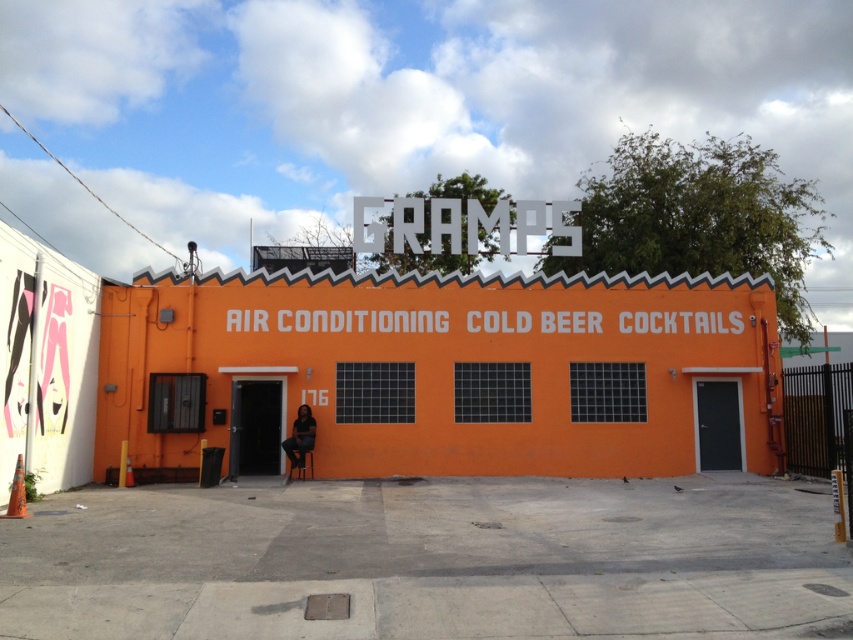
Question: Does white plastic sign at upper center appear under matte black chair at center?

Choices:
 (A) yes
 (B) no

Answer: (B)

Question: Among these points, which one is nearest to the camera?

Choices:
 (A) (293, 451)
 (B) (482, 225)

Answer: (A)

Question: Does white plastic sign at upper center lie behind matte black chair at center?

Choices:
 (A) yes
 (B) no

Answer: (A)

Question: Which object is farther from the camera taking this photo?

Choices:
 (A) matte black chair at center
 (B) white plastic sign at upper center

Answer: (B)

Question: In this image, where is white plastic sign at upper center located relative to matte black chair at center?

Choices:
 (A) right
 (B) left

Answer: (A)